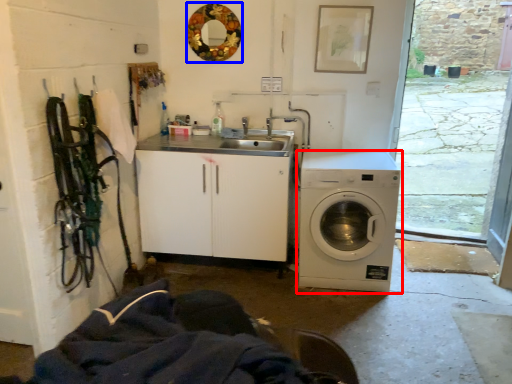
Question: Which of the following is the farthest to the observer, washing machine (highlighted by a red box) or mirror (highlighted by a blue box)?

Choices:
 (A) washing machine
 (B) mirror

Answer: (B)